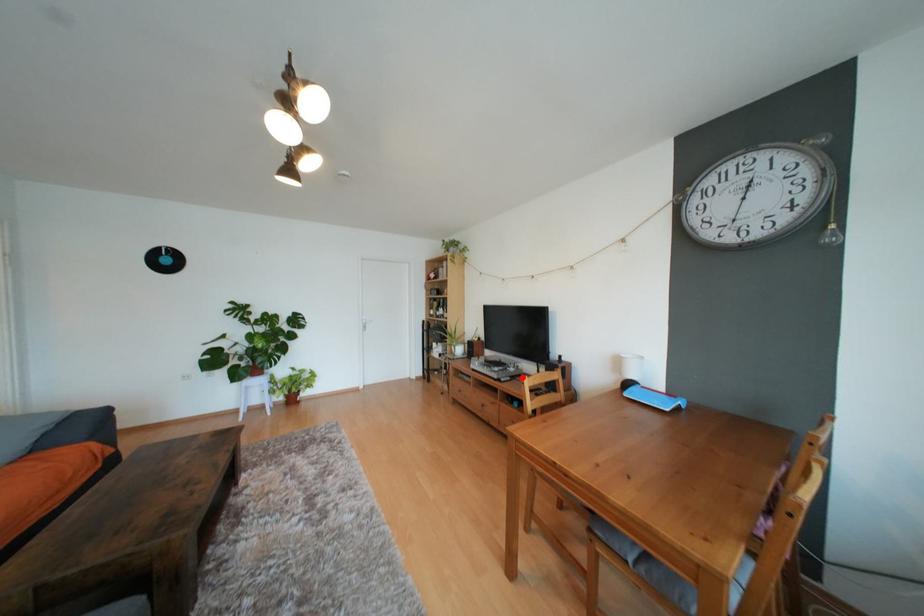
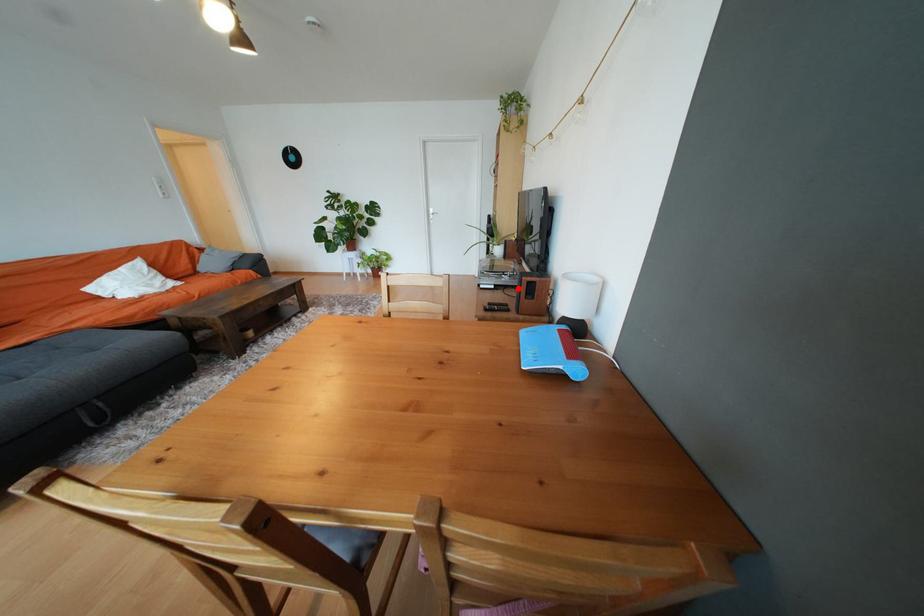
I am providing you with two images of the same scene from different viewpoints. A red point is marked on the first image and another point is marked on the second image. Is the marked point in image1 the same physical position as the marked point in image2?

Yes